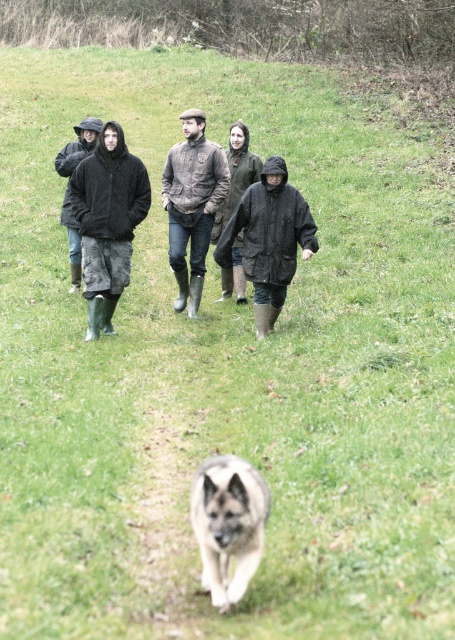
Between gray-furred dog at center and leather jacket at center, which one is positioned higher?

Positioned higher is leather jacket at center.

Which is more to the right, gray-furred dog at center or leather jacket at center?

gray-furred dog at center is more to the right.

Image resolution: width=455 pixels, height=640 pixels. I want to click on gray-furred dog at center, so click(228, 524).

Locate an element on the screen. The image size is (455, 640). gray-furred dog at center is located at coordinates (228, 524).

Between dark matte jacket at center and gray-furred dog at center, which one is positioned lower?

gray-furred dog at center

Is dark matte jacket at center wider than gray-furred dog at center?

Yes, dark matte jacket at center is wider than gray-furred dog at center.

Describe the element at coordinates (268, 240) in the screenshot. I see `dark matte jacket at center` at that location.

The image size is (455, 640). I want to click on dark matte jacket at center, so click(268, 240).

Can you confirm if dark brown leather jacket at center is bigger than camouflage jacket at left?

Yes, dark brown leather jacket at center is bigger than camouflage jacket at left.

Can you confirm if dark brown leather jacket at center is wider than camouflage jacket at left?

Yes, dark brown leather jacket at center is wider than camouflage jacket at left.

Who is more distant from viewer, (x=236, y=138) or (x=56, y=161)?

Point (x=56, y=161)

Locate an element on the screen. The height and width of the screenshot is (640, 455). dark brown leather jacket at center is located at coordinates (237, 173).